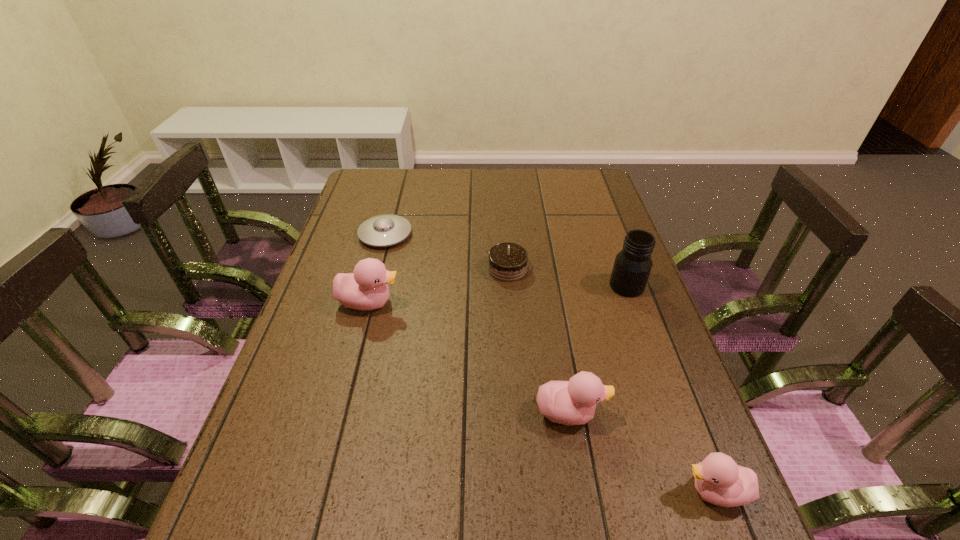
You are a GUI agent. You are given a task and a screenshot of the screen. Output one action in this format:
    pyautogui.click(x=<x>, y=<y>)
    Task: Click on the vacant region located on the front-facing side of the third tallest object
    This screenshot has height=540, width=960.
    Given the screenshot: What is the action you would take?
    pyautogui.click(x=628, y=413)

At what (x,y) coordinates should I click in order to perform the action: click on free region located 0.300m on the front-facing side of the nearest duckling. Please return your answer as a coordinate pair (x, y). Looking at the image, I should click on (519, 492).

Locate an element on the screen. The height and width of the screenshot is (540, 960). free space located on the front-facing side of the nearest duckling is located at coordinates point(622,492).

Image resolution: width=960 pixels, height=540 pixels. I want to click on blank space located on the front-facing side of the nearest duckling, so point(477,492).

Image resolution: width=960 pixels, height=540 pixels. Identify the location of free location located 0.230m on the front of the second shortest object. (514, 346).

Where is `vacant space situated on the right of the farthest object`? The height and width of the screenshot is (540, 960). vacant space situated on the right of the farthest object is located at coordinates (515, 234).

Locate an element on the screen. vacant position located on the front of the jar is located at coordinates (644, 334).

I want to click on object that is at the near edge, so pos(719,480).

Locate an element on the screen. This screenshot has width=960, height=540. duckling that is positioned at the left edge is located at coordinates (365, 289).

Locate an element on the screen. The image size is (960, 540). saucer present at the left edge is located at coordinates (385, 230).